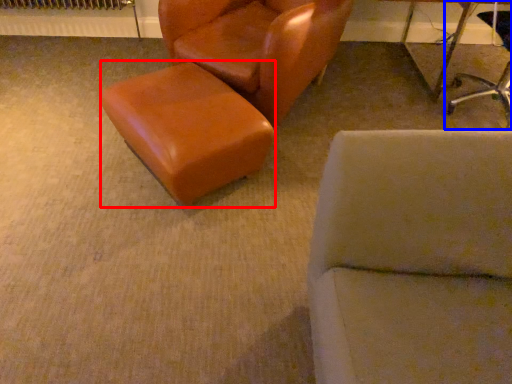
Question: Which object is further to the camera taking this photo, stool (highlighted by a red box) or chair (highlighted by a blue box)?

Choices:
 (A) stool
 (B) chair

Answer: (B)